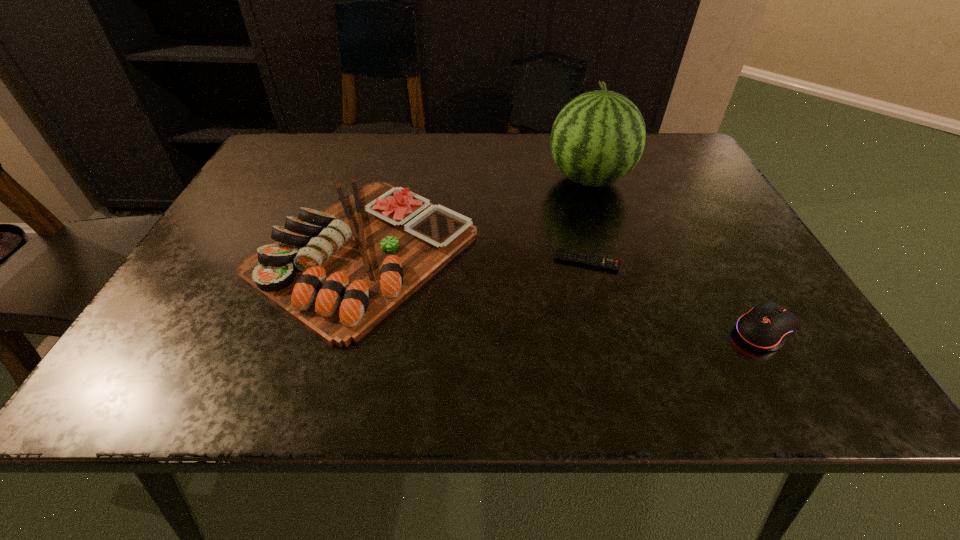
The height and width of the screenshot is (540, 960). In order to click on object that is the closest to the third tallest object in this screenshot , I will do `click(604, 263)`.

The width and height of the screenshot is (960, 540). Identify the location of object that stands as the second closest to the shortest object. (598, 137).

Where is `vacant point that satisfies the following two spatial constraints: 1. on the back side of the watermelon; 2. on the right side of the shortest object`? vacant point that satisfies the following two spatial constraints: 1. on the back side of the watermelon; 2. on the right side of the shortest object is located at coordinates (566, 179).

Locate an element on the screen. This screenshot has width=960, height=540. vacant position in the image that satisfies the following two spatial constraints: 1. on the front side of the remote control; 2. on the left side of the third shortest object is located at coordinates (361, 261).

Locate an element on the screen. This screenshot has height=540, width=960. vacant space that satisfies the following two spatial constraints: 1. on the back side of the shortest object; 2. on the left side of the tallest object is located at coordinates (566, 179).

At what (x,y) coordinates should I click in order to perform the action: click on free space that satisfies the following two spatial constraints: 1. on the front side of the third tallest object; 2. on the right side of the tallest object. Please return your answer as a coordinate pair (x, y). The image size is (960, 540). Looking at the image, I should click on (636, 329).